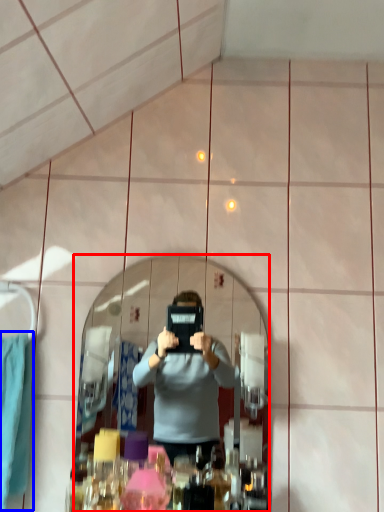
Question: Which of the following is the closest to the observer, mirror (highlighted by a red box) or clothe (highlighted by a blue box)?

Choices:
 (A) mirror
 (B) clothe

Answer: (B)